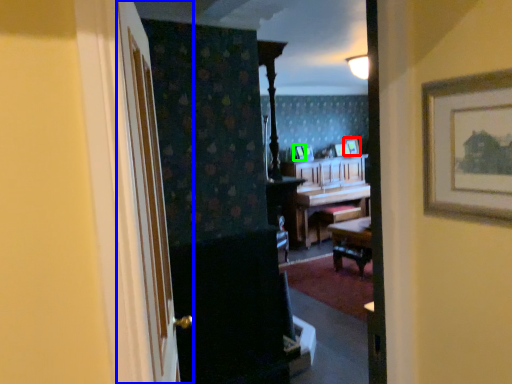
Question: Which object is the closest to the picture frame (highlighted by a red box)? Choose among these: door (highlighted by a blue box) or picture frame (highlighted by a green box).

Choices:
 (A) door
 (B) picture frame

Answer: (B)